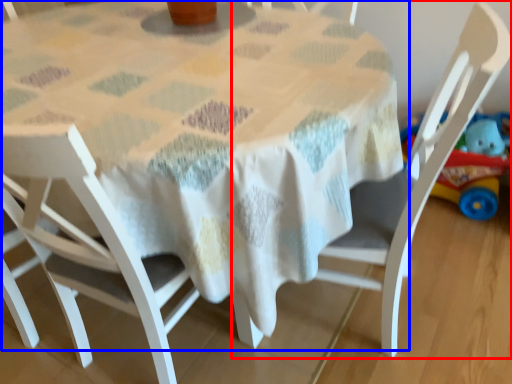
Question: Which of the following is the farthest to the observer, chair (highlighted by a red box) or table (highlighted by a blue box)?

Choices:
 (A) chair
 (B) table

Answer: (A)